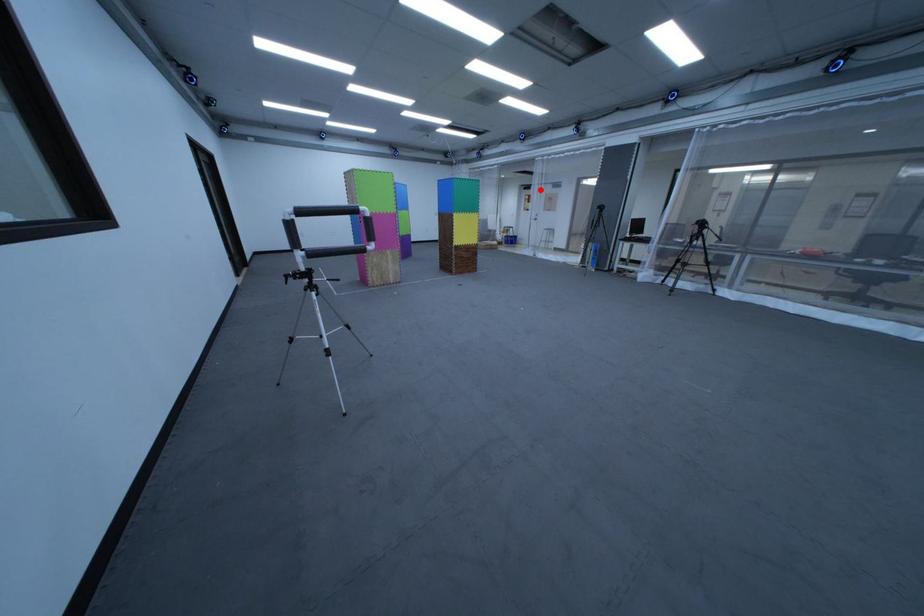
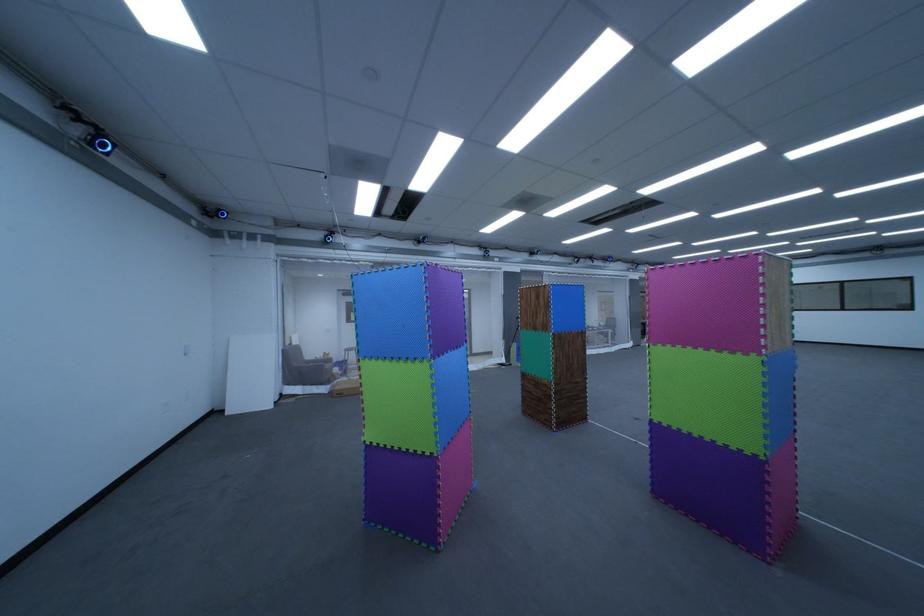
Where in the second image is the point corresponding to the highlighted location from the first image?

(359, 296)